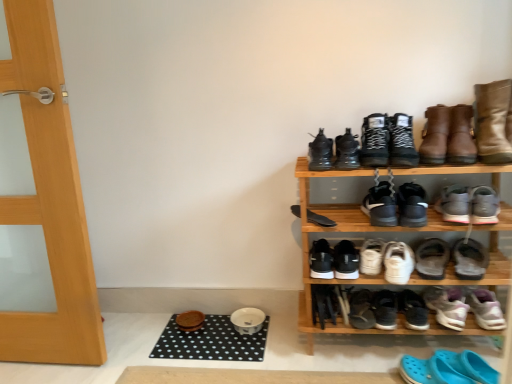
Question: From their relative heights in the image, would you say black matte sneakers at lower center, which is the seventeenth footwear in top-to-bottom order, is taller or shorter than purple suede sneakers at lower right, which appears as the 5th footwear when ordered from the bottom?

Choices:
 (A) tall
 (B) short

Answer: (B)

Question: Is black matte sneakers at lower center, which is counted as the 4th footwear, starting from the bottom, in front of or behind purple suede sneakers at lower right, acting as the 16th footwear starting from the top, in the image?

Choices:
 (A) front
 (B) behind

Answer: (B)

Question: Which is nearer to the black matte sneakers at lower center, which is counted as the 4th footwear, starting from the bottom?

Choices:
 (A) shiny black boot at upper center, which is the 5th footwear in top-to-bottom order
 (B) black dotted mat at lower center, the first doormat in the back-to-front sequence
 (C) black rubber doormat at lower center, positioned as the first doormat in front-to-back order
 (D) wooden shoe rack at upper right
 (E) leather boots at upper right, the first footwear positioned from the top

Answer: (D)

Question: Estimate the real-world distances between objects in this image. Which object is farther from the black suede boots at upper center, the 18th footwear positioned from the bottom?

Choices:
 (A) purple suede sneakers at lower right, which appears as the 5th footwear when ordered from the bottom
 (B) wooden door at left
 (C) wooden shoe rack at upper right
 (D) white matte sneakers at center-right, placed as the thirteenth footwear when sorted from top to bottom
 (E) brown leather boot at upper right

Answer: (B)